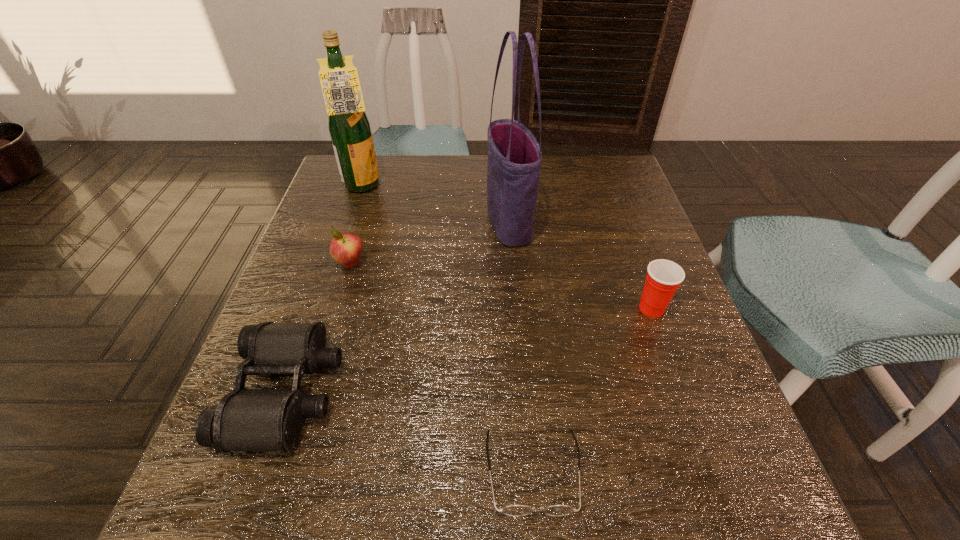
Where is `tote bag`? Image resolution: width=960 pixels, height=540 pixels. tote bag is located at coordinates click(514, 156).

This screenshot has width=960, height=540. I want to click on liquor, so click(x=349, y=127).

Where is `Dixie cup`? Image resolution: width=960 pixels, height=540 pixels. Dixie cup is located at coordinates (663, 277).

You are a GUI agent. You are given a task and a screenshot of the screen. Output one action in this format:
    pyautogui.click(x=<x>, y=<y>)
    Task: Click on the fourth farthest object
    
    Given the screenshot: What is the action you would take?
    pyautogui.click(x=663, y=277)

Locate an element on the screen. This screenshot has height=540, width=960. apple is located at coordinates (345, 248).

At what (x,y) coordinates should I click in order to perform the action: click on binoculars. Please return your answer as a coordinate pair (x, y). Image resolution: width=960 pixels, height=540 pixels. Looking at the image, I should click on (245, 419).

The height and width of the screenshot is (540, 960). What are the coordinates of `spectacles` in the screenshot? It's located at (513, 510).

Find the location of a particular element. Image resolution: width=960 pixels, height=540 pixels. vacant space located 0.220m on the right of the tote bag is located at coordinates (619, 224).

You are a GUI agent. You are given a task and a screenshot of the screen. Output one action in this format:
    pyautogui.click(x=<x>, y=<y>)
    Task: Click on the vacant space located on the front-facing side of the liquor
    
    Given the screenshot: What is the action you would take?
    pyautogui.click(x=405, y=187)

Locate an element on the screen. vacant space located on the back of the rightmost object is located at coordinates (618, 218).